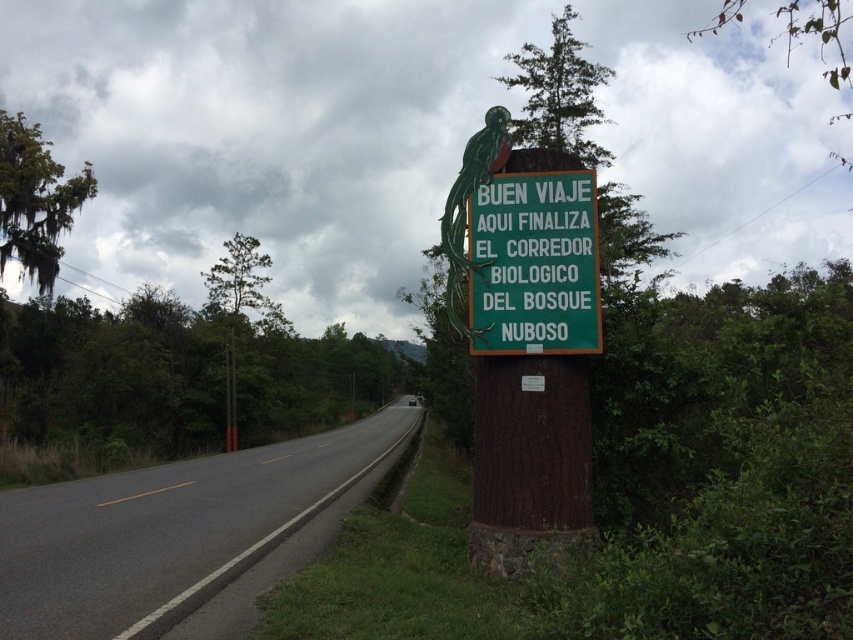
Question: Which object is closer to the camera taking this photo?

Choices:
 (A) asphalt road at center
 (B) green matte sign at center

Answer: (A)

Question: Which point appears farthest from the camera in this image?

Choices:
 (A) (556, 316)
 (B) (376, 456)

Answer: (B)

Question: Which point appears closest to the camera in this image?

Choices:
 (A) (469, 349)
 (B) (39, 499)

Answer: (A)

Question: Where is asphalt road at center located in relation to green matte sign at center in the image?

Choices:
 (A) above
 (B) below

Answer: (B)

Question: Is asphalt road at center wider than green matte sign at center?

Choices:
 (A) yes
 (B) no

Answer: (A)

Question: Is asphalt road at center smaller than green matte sign at center?

Choices:
 (A) yes
 (B) no

Answer: (B)